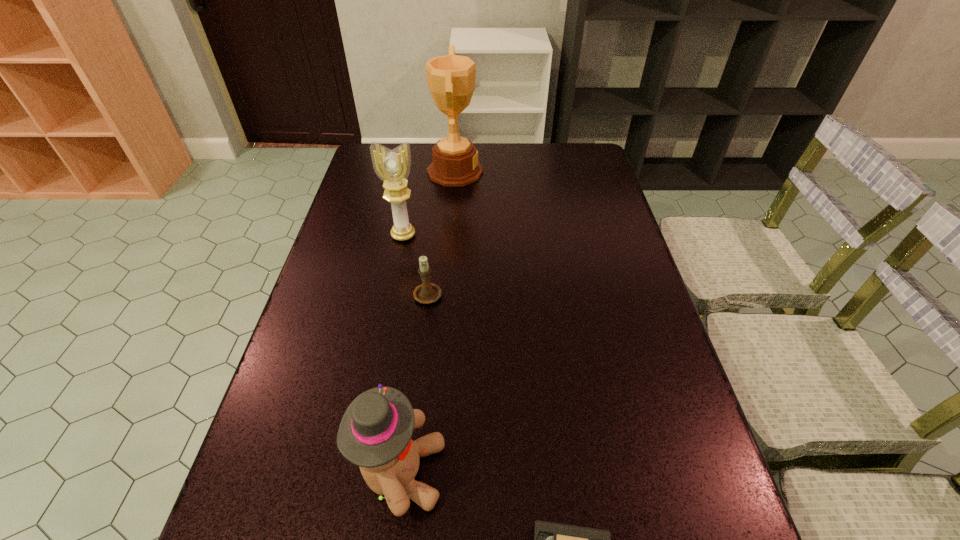
Where is `vacant area between the third tallest object and the shorter award`? vacant area between the third tallest object and the shorter award is located at coordinates (402, 354).

At what (x,y) coordinates should I click in order to perform the action: click on free space between the second tallest object and the rag_doll. Please return your answer as a coordinate pair (x, y). The width and height of the screenshot is (960, 540). Looking at the image, I should click on (402, 354).

In order to click on free space between the third shortest object and the third farthest object in this screenshot , I will do `click(415, 383)`.

At what (x,y) coordinates should I click in order to perform the action: click on free spot between the rag_doll and the candle holder. Please return your answer as a coordinate pair (x, y). Looking at the image, I should click on (415, 383).

Identify the location of object that stands as the second closest to the third shortest object. Image resolution: width=960 pixels, height=540 pixels. (426, 293).

This screenshot has height=540, width=960. I want to click on object that is the fourth closest to the fourth tallest object, so click(551, 539).